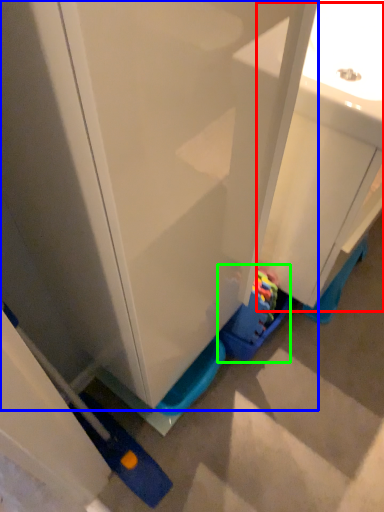
Question: Based on their relative distances, which object is farther from sink (highlighted by a red box)? Choose from cabinetry (highlighted by a blue box) and toy (highlighted by a green box).

Choices:
 (A) cabinetry
 (B) toy

Answer: (B)